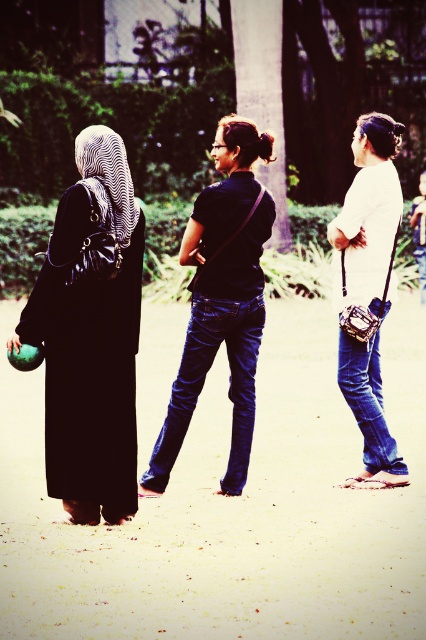
In the scene shown: You are standing at point (75,163) and want to walk to point (344,234). Is the destination point in front of or behind you?

The destination point (344,234) is in front of you because it is located in front of point (75,163).

You are standing at the point labeled point [373,360] and want to walk to the point labeled point [376,388]. Which direction should you move to reach your destination?

To reach point [376,388] from point [373,360], you should move backward since point [373,360] is in front of point [376,388].